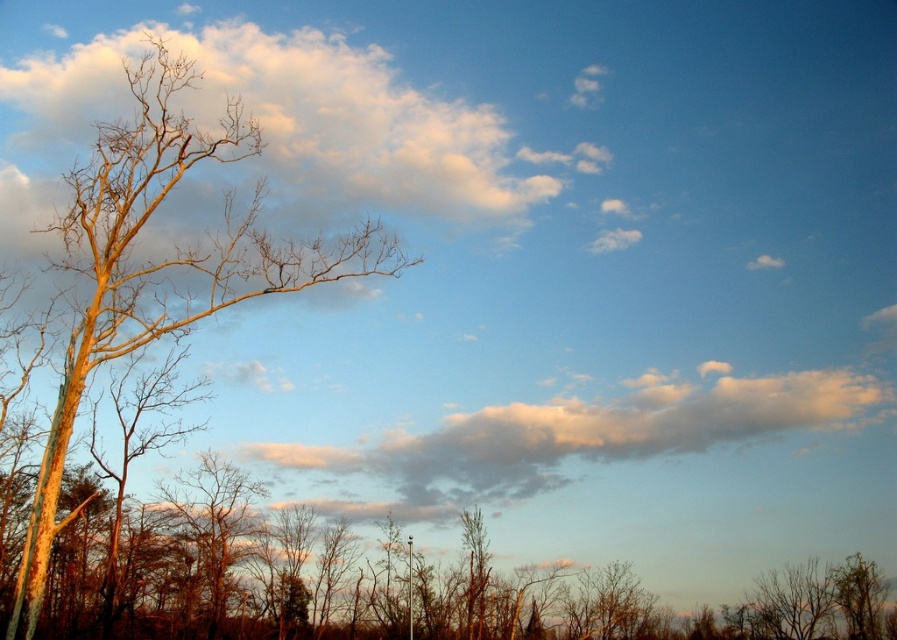
Which is behind, point (251, 51) or point (643, 397)?

Positioned behind is point (643, 397).

At what (x,y) coordinates should I click in order to perform the action: click on cloudy sky at upper left. Please return your answer as a coordinate pair (x, y). Looking at the image, I should click on (299, 120).

What are the coordinates of `cloudy sky at upper left` in the screenshot? It's located at [x=299, y=120].

Locate an element on the screen. smooth brown tree at left is located at coordinates (162, 266).

Which of these two, smooth brown tree at left or white fluffy cloud at upper center, stands taller?

Standing taller between the two is smooth brown tree at left.

Which is behind, point (234, 118) or point (677, 384)?

Point (677, 384)

Find the location of a particular element. This screenshot has width=897, height=640. smooth brown tree at left is located at coordinates [162, 266].

Can you confirm if cloudy sky at upper left is positioned to the right of smooth brown tree at left?

Correct, you'll find cloudy sky at upper left to the right of smooth brown tree at left.

Is cloudy sky at upper left taller than smooth brown tree at left?

Incorrect, cloudy sky at upper left's height is not larger of smooth brown tree at left's.

Who is more distant from viewer, (x=61, y=104) or (x=211, y=285)?

The point (x=61, y=104) is more distant.

Find the location of a particular element. This screenshot has width=897, height=640. cloudy sky at upper left is located at coordinates (299, 120).